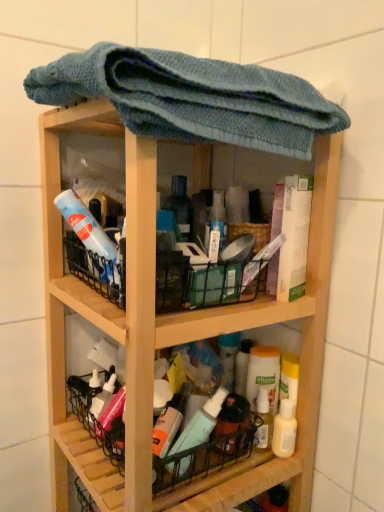
The height and width of the screenshot is (512, 384). What do you see at coordinates (193, 98) in the screenshot? I see `blue knitted towel at upper center` at bounding box center [193, 98].

Find the location of a particular element. This screenshot has height=512, width=384. translucent plastic mouthwash at lower right is located at coordinates (284, 429).

Find the location of a particular element. Image resolution: width=384 pixels, height=512 pixels. mouthwash located below the metallic black basket at lower center (from the image's perspective) is located at coordinates (284, 429).

From a real-world perspective, between metallic black basket at lower center and translucent plastic mouthwash at lower right, who is vertically higher?

translucent plastic mouthwash at lower right.

Is metallic black basket at lower center inside or outside of translucent plastic mouthwash at lower right?

metallic black basket at lower center exists outside the volume of translucent plastic mouthwash at lower right.

Which object is wider, metallic black basket at lower center or translucent plastic mouthwash at lower right?

With larger width is metallic black basket at lower center.

Consider the image. Is wooden shelf at center completely or partially inside blue knitted towel at upper center?

No, wooden shelf at center is located outside of blue knitted towel at upper center.

Can you confirm if blue knitted towel at upper center is smaller than wooden shelf at center?

Correct, blue knitted towel at upper center occupies less space than wooden shelf at center.

Which object is further away from the camera, blue knitted towel at upper center or wooden shelf at center?

wooden shelf at center is further away from the camera.

From the image's perspective, which one is positioned lower, blue knitted towel at upper center or translucent plastic mouthwash at lower right?

From the image's view, translucent plastic mouthwash at lower right is below.

Consider the image. Would you say translucent plastic mouthwash at lower right is part of blue knitted towel at upper center's contents?

No, translucent plastic mouthwash at lower right is not a part of blue knitted towel at upper center.

Is blue knitted towel at upper center wider or thinner than translucent plastic mouthwash at lower right?

Clearly, blue knitted towel at upper center has more width compared to translucent plastic mouthwash at lower right.

Can you confirm if blue knitted towel at upper center is shorter than translucent plastic mouthwash at lower right?

Incorrect, the height of blue knitted towel at upper center does not fall short of that of translucent plastic mouthwash at lower right.

Which object is closer to the camera, metallic black basket at lower center or blue knitted towel at upper center?

blue knitted towel at upper center is closer to the camera.

From a real-world perspective, is metallic black basket at lower center under blue knitted towel at upper center?

Yes, from a real-world perspective, metallic black basket at lower center is beneath blue knitted towel at upper center.

Is metallic black basket at lower center far away from blue knitted towel at upper center?

That's not correct — metallic black basket at lower center is a little close to blue knitted towel at upper center.

From their relative heights in the image, would you say metallic black basket at lower center is taller or shorter than blue knitted towel at upper center?

Considering their sizes, metallic black basket at lower center has less height than blue knitted towel at upper center.

From the image's perspective, is translucent plastic mouthwash at lower right positioned above or below metallic black basket at lower center?

Based on their image positions, translucent plastic mouthwash at lower right is located beneath metallic black basket at lower center.

Is metallic black basket at lower center at the back of translucent plastic mouthwash at lower right?

No, translucent plastic mouthwash at lower right is not facing away from metallic black basket at lower center.

Is translucent plastic mouthwash at lower right with metallic black basket at lower center?

translucent plastic mouthwash at lower right and metallic black basket at lower center are not in contact.

Is point (276, 447) farther from viewer compared to point (124, 438)?

Yes, point (276, 447) is behind point (124, 438).

Would you say translucent plastic mouthwash at lower right is a long distance from blue knitted towel at upper center?

No, translucent plastic mouthwash at lower right is in close proximity to blue knitted towel at upper center.

From a real-world perspective, who is located lower, translucent plastic mouthwash at lower right or blue knitted towel at upper center?

translucent plastic mouthwash at lower right.

Considering the relative sizes of translucent plastic mouthwash at lower right and blue knitted towel at upper center in the image provided, is translucent plastic mouthwash at lower right smaller than blue knitted towel at upper center?

Indeed, translucent plastic mouthwash at lower right has a smaller size compared to blue knitted towel at upper center.

Is translucent plastic mouthwash at lower right situated inside blue knitted towel at upper center or outside?

The correct answer is: outside.

Based on the photo, from a real-world perspective, which object rests below the other?

metallic black basket at lower center is physically lower.

Consider the image. Can you confirm if wooden shelf at center is thinner than metallic black basket at lower center?

In fact, wooden shelf at center might be wider than metallic black basket at lower center.

Is wooden shelf at center to the left of metallic black basket at lower center from the viewer's perspective?

In fact, wooden shelf at center is to the right of metallic black basket at lower center.

Is wooden shelf at center not inside metallic black basket at lower center?

Absolutely, wooden shelf at center is external to metallic black basket at lower center.

Where is `basket directly beneath the translucent plastic mouthwash at lower right (from a real-world perspective)`? basket directly beneath the translucent plastic mouthwash at lower right (from a real-world perspective) is located at coordinates (209, 449).

Locate an element on the screen. This screenshot has width=384, height=512. shelf located below the blue knitted towel at upper center (from the image's perspective) is located at coordinates (176, 318).

Which object lies nearer to the anchor point blue knitted towel at upper center, wooden shelf at center or translucent plastic mouthwash at lower right?

wooden shelf at center is closer to blue knitted towel at upper center.

Looking at the image, which one is located closer to translucent plastic mouthwash at lower right, metallic black basket at lower center or wooden shelf at center?

metallic black basket at lower center is closer to translucent plastic mouthwash at lower right.

Which object lies further to the anchor point wooden shelf at center, translucent plastic mouthwash at lower right or metallic black basket at lower center?

The object further to wooden shelf at center is translucent plastic mouthwash at lower right.

Consider the image. Looking at the image, which one is located further to translucent plastic mouthwash at lower right, blue knitted towel at upper center or wooden shelf at center?

blue knitted towel at upper center.

Based on their spatial positions, is translucent plastic mouthwash at lower right or metallic black basket at lower center closer to blue knitted towel at upper center?

The object closer to blue knitted towel at upper center is metallic black basket at lower center.

Based on their spatial positions, is wooden shelf at center or metallic black basket at lower center further from translucent plastic mouthwash at lower right?

Among the two, wooden shelf at center is located further to translucent plastic mouthwash at lower right.

Based on their spatial positions, is wooden shelf at center or metallic black basket at lower center further from blue knitted towel at upper center?

metallic black basket at lower center.

Looking at this image, which object lies further to the anchor point metallic black basket at lower center, wooden shelf at center or blue knitted towel at upper center?

Based on the image, blue knitted towel at upper center appears to be further to metallic black basket at lower center.

Where is `shelf between blue knitted towel at upper center and metallic black basket at lower center vertically`? The height and width of the screenshot is (512, 384). shelf between blue knitted towel at upper center and metallic black basket at lower center vertically is located at coordinates (176, 318).

This screenshot has height=512, width=384. In order to click on basket between wooden shelf at center and translucent plastic mouthwash at lower right from front to back in this screenshot , I will do `click(209, 449)`.

Where is `basket between blue knitted towel at upper center and translucent plastic mouthwash at lower right from top to bottom`? basket between blue knitted towel at upper center and translucent plastic mouthwash at lower right from top to bottom is located at coordinates (x=209, y=449).

The width and height of the screenshot is (384, 512). Find the location of `shelf between blue knitted towel at upper center and translucent plastic mouthwash at lower right in the vertical direction`. shelf between blue knitted towel at upper center and translucent plastic mouthwash at lower right in the vertical direction is located at coordinates (176, 318).